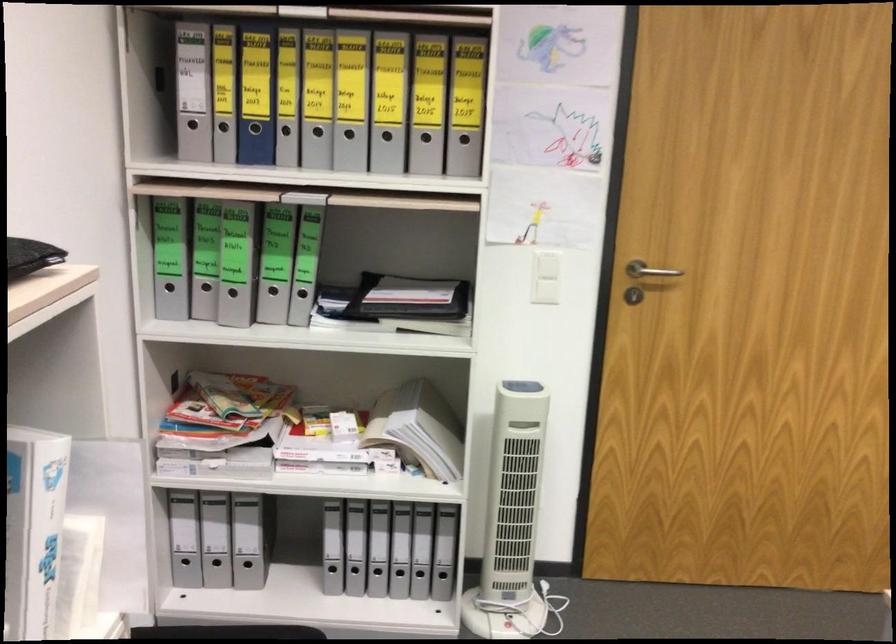
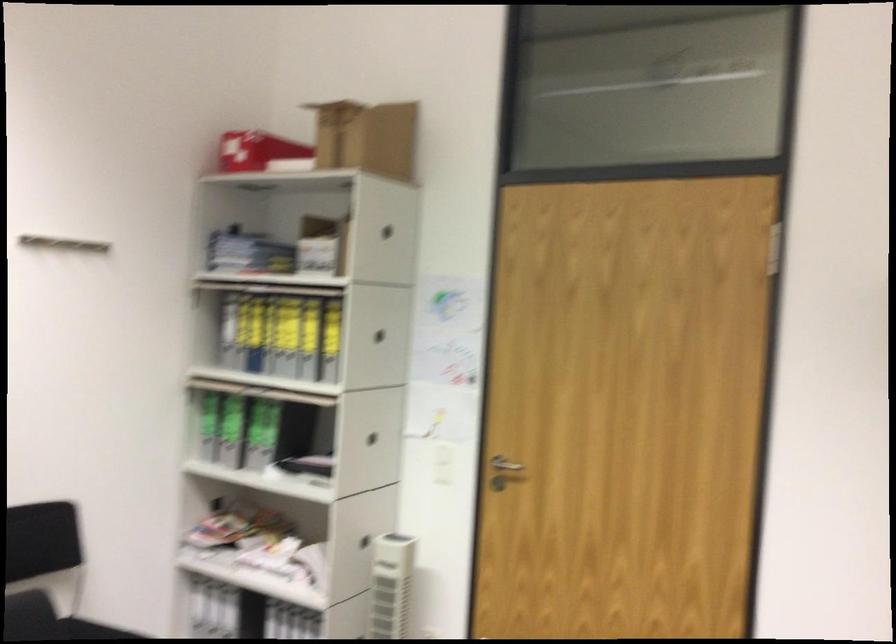
Find the pixel in the second image that matches (495,100) in the first image.

(378, 335)